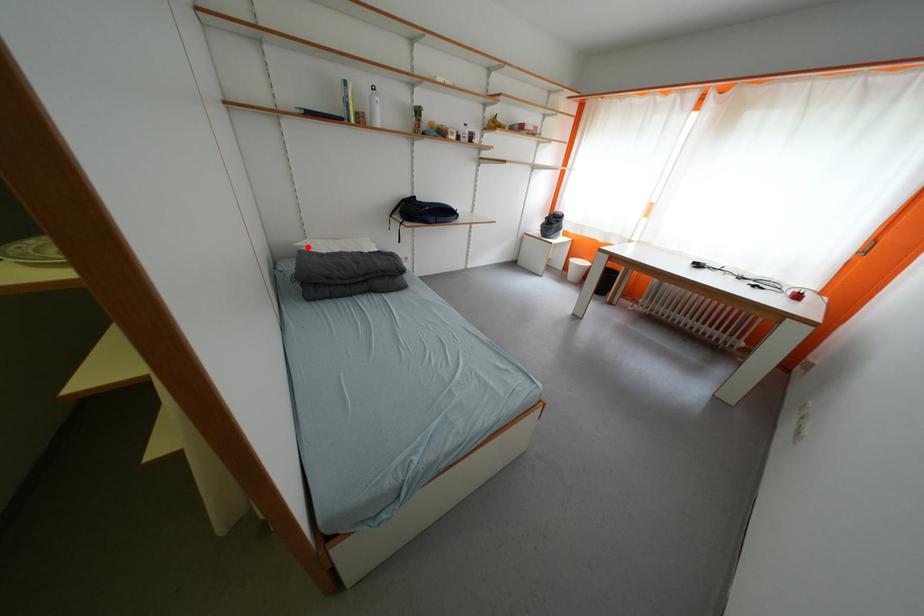
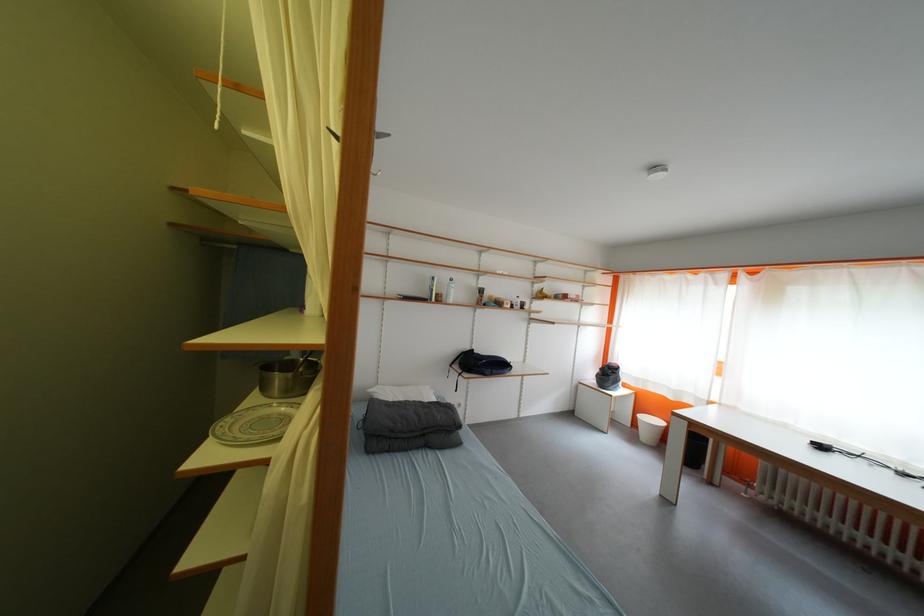
Where in the second image is the point corresponding to the highlighted location from the first image?

(380, 392)